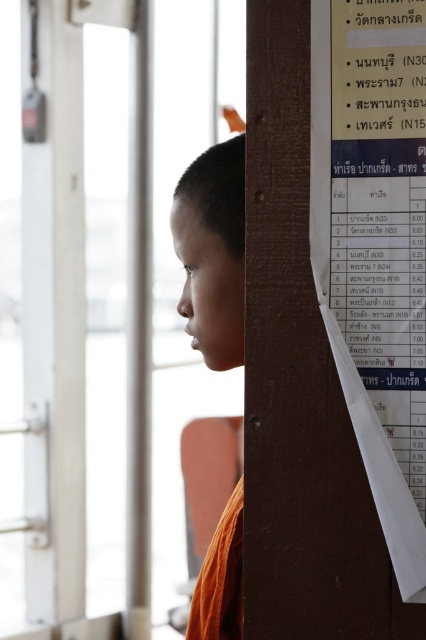
Question: Does white paper at right appear on the right side of orange cloth at lower right?

Choices:
 (A) no
 (B) yes

Answer: (B)

Question: From the image, what is the correct spatial relationship of white paper at right in relation to orange cloth at lower right?

Choices:
 (A) above
 (B) below

Answer: (A)

Question: Which object is farther from the camera taking this photo?

Choices:
 (A) white paper at right
 (B) orange cloth at lower right

Answer: (B)

Question: Is white paper at right positioned at the back of orange cloth at lower right?

Choices:
 (A) yes
 (B) no

Answer: (B)

Question: Which object appears farthest from the camera in this image?

Choices:
 (A) white paper at right
 (B) orange cloth at lower right

Answer: (B)